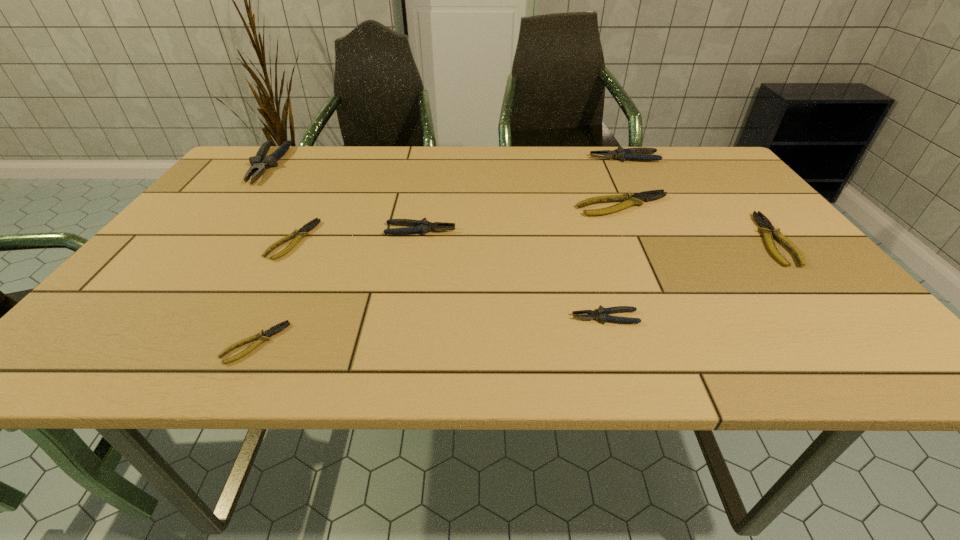
The image size is (960, 540). Find the location of `vacant space located 0.130m on the right of the second yellow pliers from right to left`. vacant space located 0.130m on the right of the second yellow pliers from right to left is located at coordinates (721, 206).

Find the location of a particular element. The height and width of the screenshot is (540, 960). free space located 0.360m on the back of the rightmost pliers is located at coordinates coord(698,152).

You are a GUI agent. You are given a task and a screenshot of the screen. Output one action in this format:
    pyautogui.click(x=<x>, y=<y>)
    Task: Click on the free space located at the gripping part of the smallest gray pliers
    
    Given the screenshot: What is the action you would take?
    pyautogui.click(x=472, y=318)

Where is `blank area located 0.130m at the gripping part of the smallest gray pliers`? blank area located 0.130m at the gripping part of the smallest gray pliers is located at coordinates (504, 318).

Locate an element on the screen. Image resolution: width=960 pixels, height=540 pixels. vacant space situated 0.240m at the gripping part of the smallest gray pliers is located at coordinates (446, 318).

This screenshot has height=540, width=960. What are the coordinates of `vacant region located on the right of the seventh tallest object` in the screenshot? It's located at (x=463, y=240).

Where is `free space located on the left of the smallest yellow pliers`? This screenshot has width=960, height=540. free space located on the left of the smallest yellow pliers is located at coordinates (200, 343).

Locate an element on the screen. This screenshot has width=960, height=540. object present at the near edge is located at coordinates (262, 336).

Find the location of a particular element. object present at the left edge is located at coordinates (259, 163).

Find the location of a particular element. This screenshot has height=540, width=960. object located at the right edge is located at coordinates (766, 228).